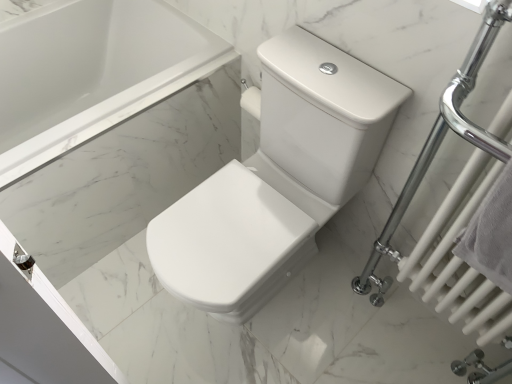
I want to click on vacant space underneath white glossy towel rack at right (from a real-world perspective), so click(x=410, y=336).